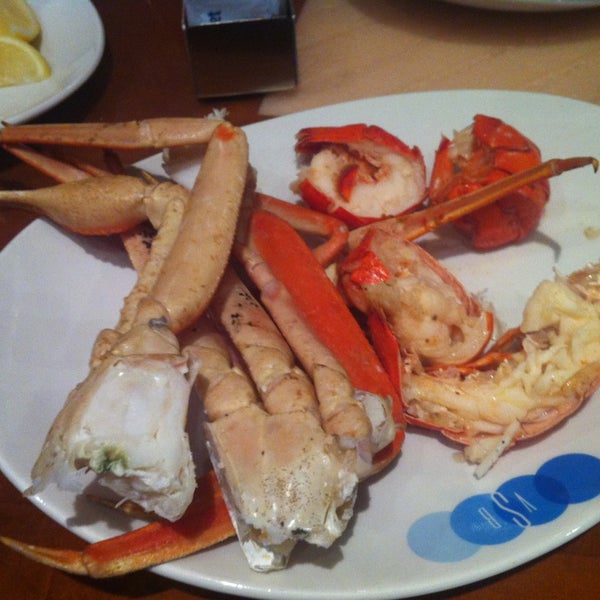
I want to click on rim of white plate, so click(501, 564).